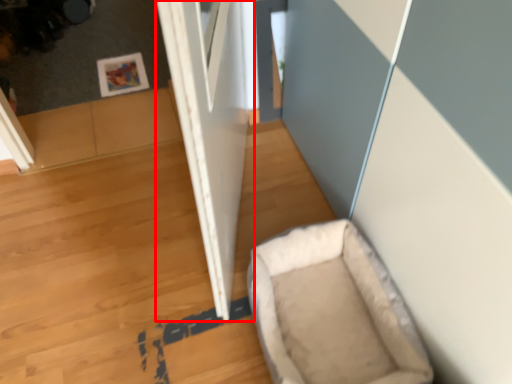
Question: In this image, where is door (annotated by the red box) located relative to dog bed?

Choices:
 (A) right
 (B) left

Answer: (B)